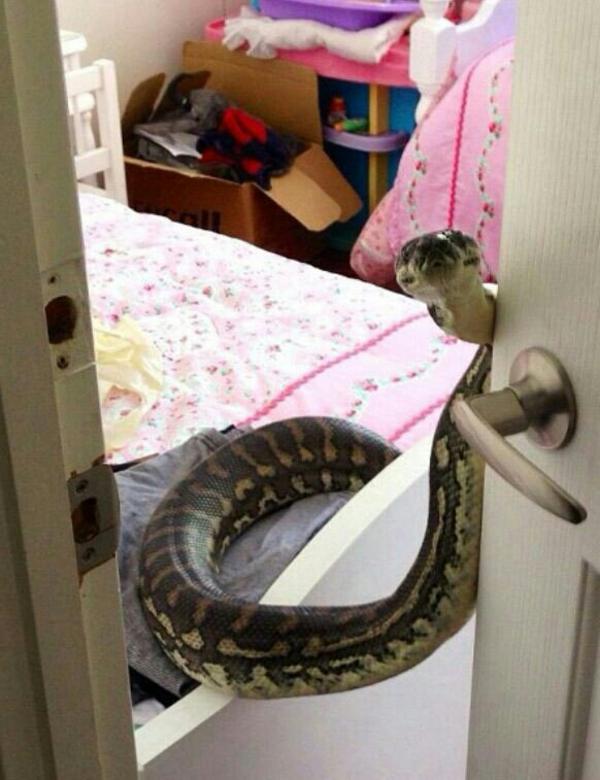
The width and height of the screenshot is (600, 780). I want to click on handle, so click(x=480, y=444).